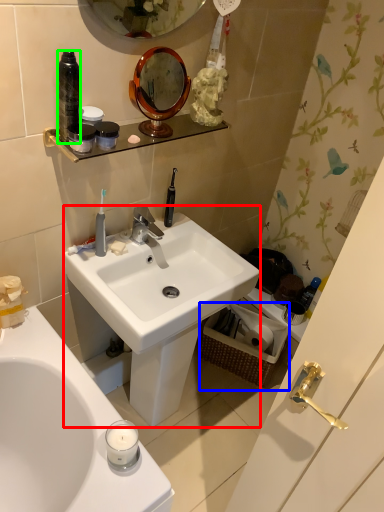
Question: Which object is the farthest from sink (highlighted by a red box)? Choose among these: picnic basket (highlighted by a blue box) or bottle (highlighted by a green box).

Choices:
 (A) picnic basket
 (B) bottle

Answer: (B)